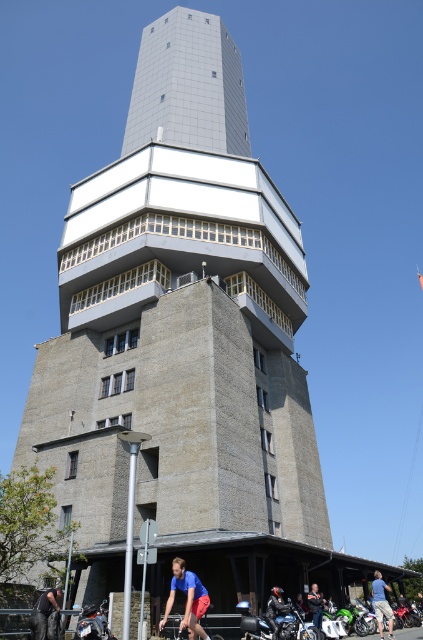
You are a photographer trying to capture the building from a specific angle. You have two items in your bag for stabilization. The dark gray jeans at lower left and the leather jacket at lower center. If you want to use the wider item to stabilize your camera, which one should you choose?

The dark gray jeans at lower left is wider than the leather jacket at lower center, so you should choose the dark gray jeans at lower left for better stabilization.